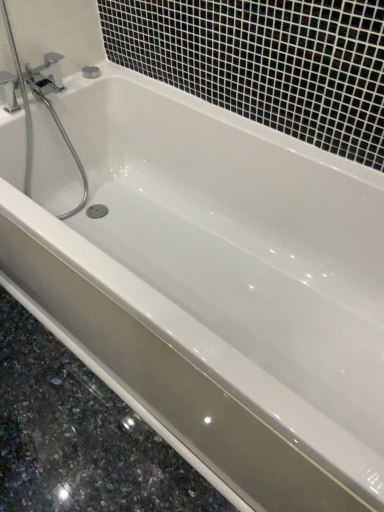
What do you see at coordinates (79, 435) in the screenshot? Image resolution: width=384 pixels, height=512 pixels. I see `white glossy ledge at lower center` at bounding box center [79, 435].

This screenshot has width=384, height=512. Find the location of `white glossy ledge at lower center`. white glossy ledge at lower center is located at coordinates (79, 435).

This screenshot has width=384, height=512. In order to click on white glossy ledge at lower center in this screenshot , I will do `click(79, 435)`.